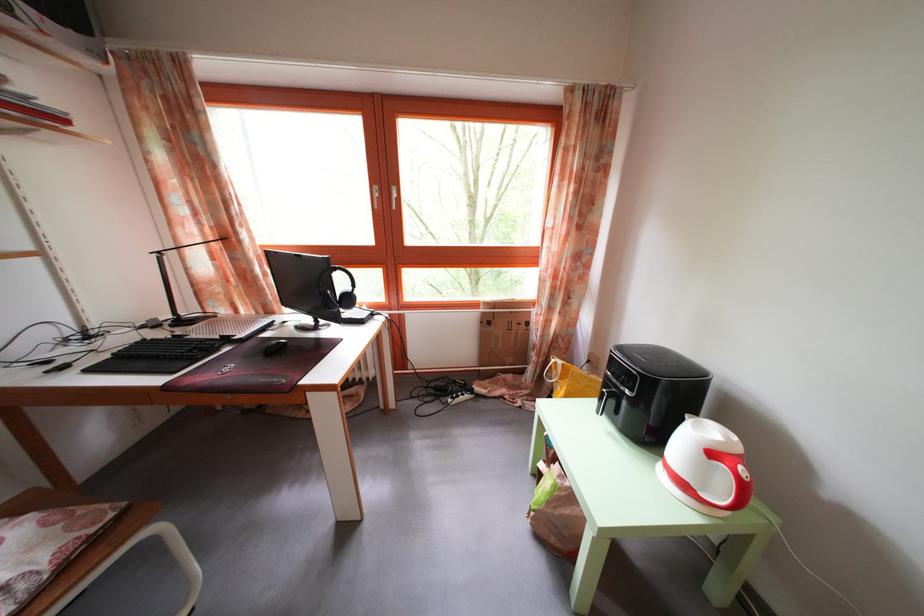
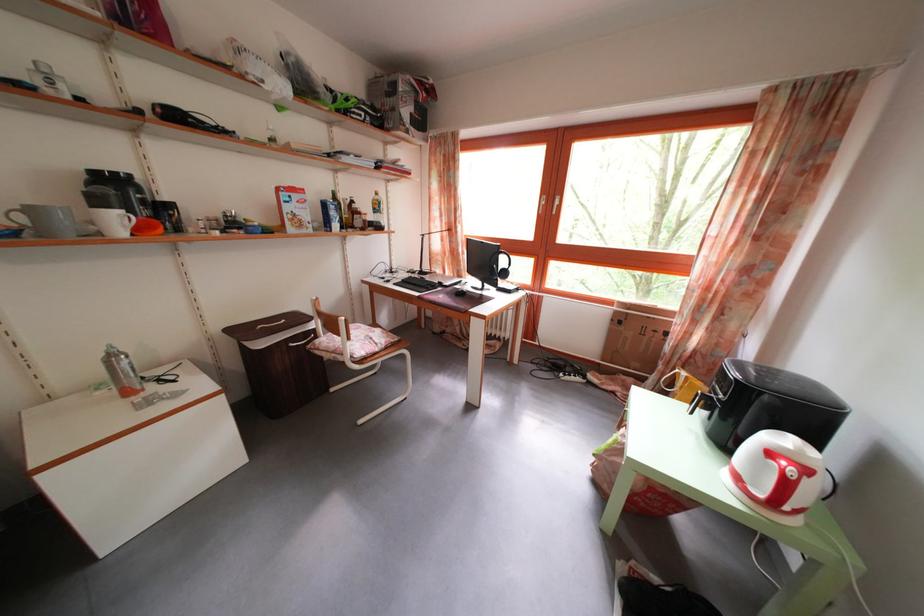
Question: I am providing you with two images of the same scene from different viewpoints. After the viewpoint changes to image2, which objects are now occluded?

Choices:
 (A) white window handle
 (B) metal spray bottle
 (C) cardboard box
 (D) none of these

Answer: (D)